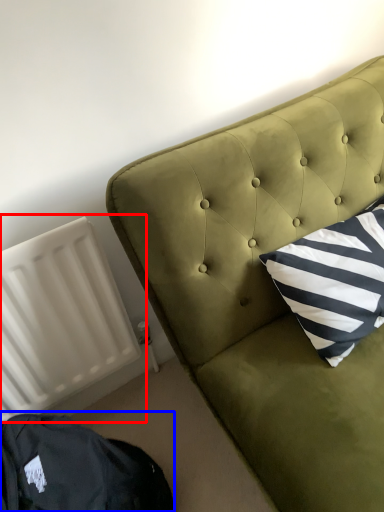
Question: Which of the following is the closest to the observer, radiator (highlighted by a red box) or bean bag chair (highlighted by a blue box)?

Choices:
 (A) radiator
 (B) bean bag chair

Answer: (B)